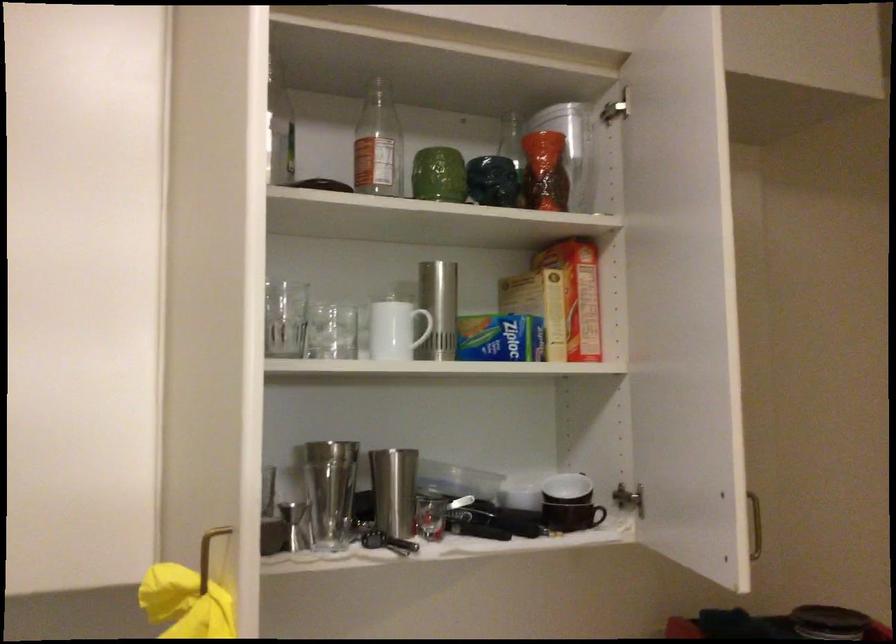
Find where to lift the red ceramic vase. Please return your answer as a coordinate pair (x, y).

(545, 171)